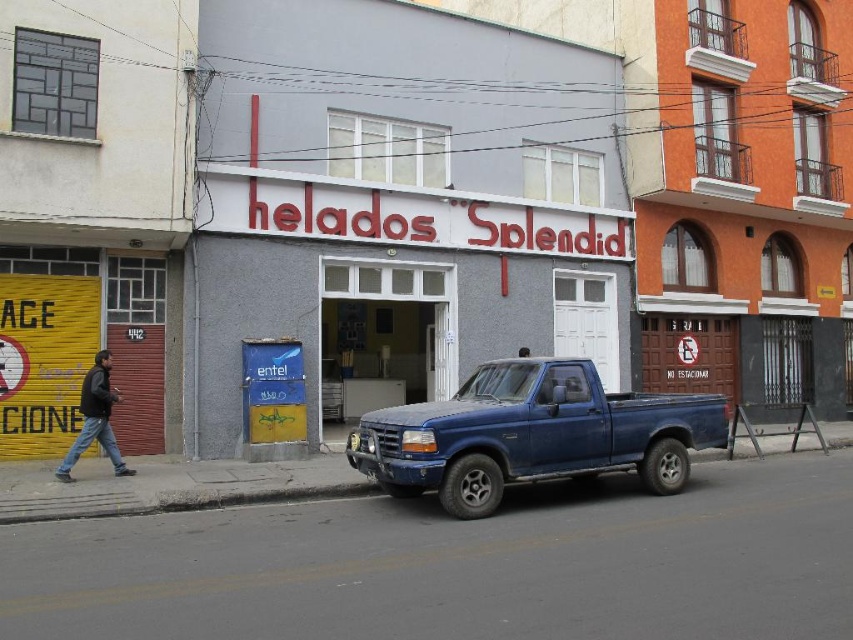
Question: Can you confirm if matte blue truck at center is positioned below dark blue jeans at lower left?

Choices:
 (A) no
 (B) yes

Answer: (A)

Question: Which of the following is the farthest from the observer?

Choices:
 (A) dark blue jeans at lower left
 (B) matte blue truck at center

Answer: (A)

Question: Does matte blue truck at center appear on the left side of dark blue jeans at lower left?

Choices:
 (A) no
 (B) yes

Answer: (A)

Question: Does matte blue truck at center have a smaller size compared to dark blue jeans at lower left?

Choices:
 (A) yes
 (B) no

Answer: (B)